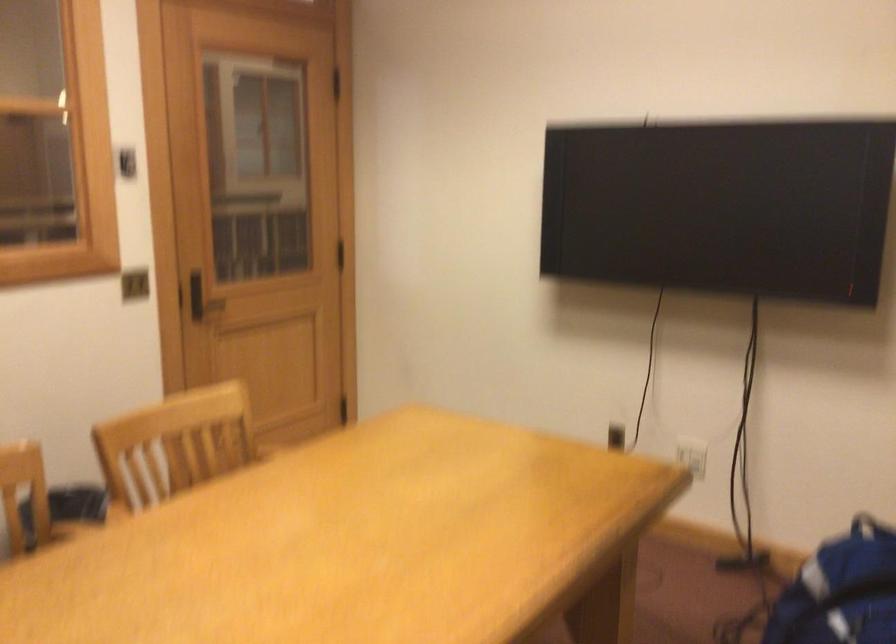
At what (x,y) coordinates should I click in order to perform the action: click on black light switch. Please return your answer as a coordinate pair (x, y). The height and width of the screenshot is (644, 896). Looking at the image, I should click on (134, 283).